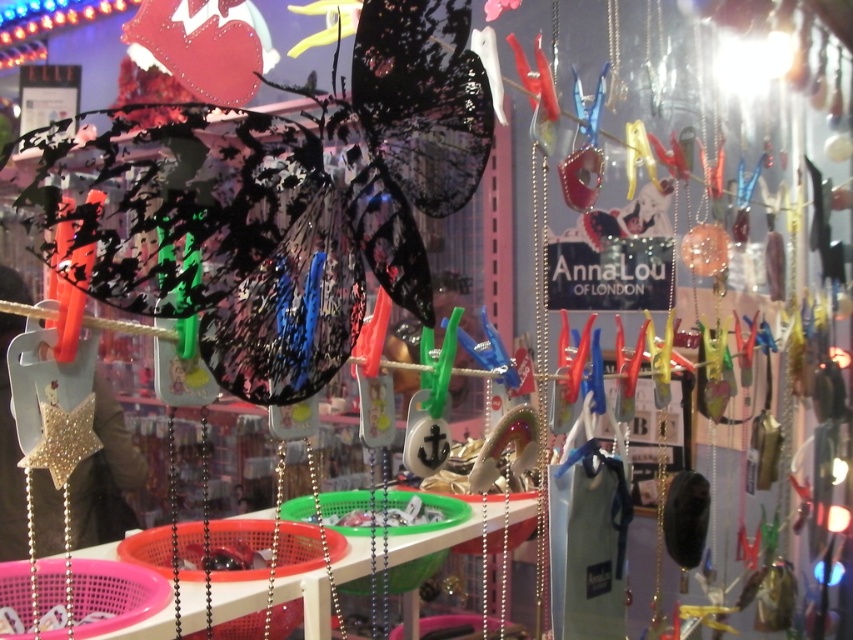
You are a customer at AnnaLou OF LONDON store. You see a transparent glossy butterfly at center and a silver metallic chain at center. Which one is bigger?

The transparent glossy butterfly at center is larger than the silver metallic chain at center.